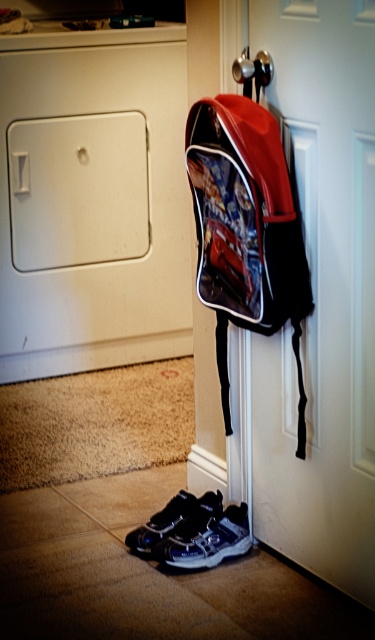
Does white matte door at center have a greater width compared to shiny black sneaker at lower center?

Indeed, white matte door at center has a greater width compared to shiny black sneaker at lower center.

Which is below, white matte door at center or shiny black sneaker at lower center?

shiny black sneaker at lower center is below.

Locate an element on the screen. This screenshot has height=640, width=375. white matte door at center is located at coordinates (322, 298).

Find the location of `white matte door at center`. white matte door at center is located at coordinates (322, 298).

Who is positioned more to the left, white matte door at center or shiny red backpack at door?

Positioned to the left is shiny red backpack at door.

At what (x,y) coordinates should I click in order to perform the action: click on white matte door at center. Please return your answer as a coordinate pair (x, y). Looking at the image, I should click on (322, 298).

Locate an element on the screen. white matte door at center is located at coordinates tap(322, 298).

Where is `white matte door at center`? white matte door at center is located at coordinates (322, 298).

Which is in front, point (258, 156) or point (135, 529)?

Point (258, 156)

Does shiny red backpack at door appear under shiny black sneaker at lower center?

Incorrect, shiny red backpack at door is not positioned below shiny black sneaker at lower center.

Who is more distant from viewer, [277,314] or [148,547]?

The point [148,547] is behind.

Locate an element on the screen. Image resolution: width=375 pixels, height=640 pixels. shiny red backpack at door is located at coordinates (247, 228).